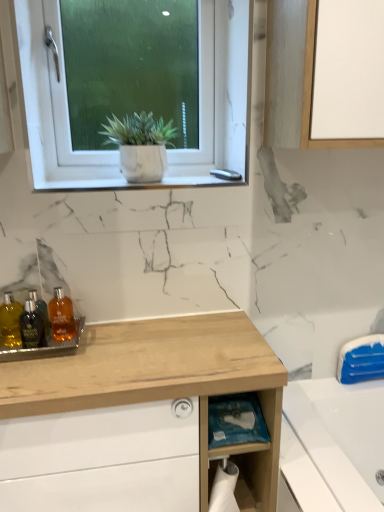
Where is `free location above wooden cabinet at lower left (from a real-world perspective)`? Image resolution: width=384 pixels, height=512 pixels. free location above wooden cabinet at lower left (from a real-world perspective) is located at coordinates (127, 331).